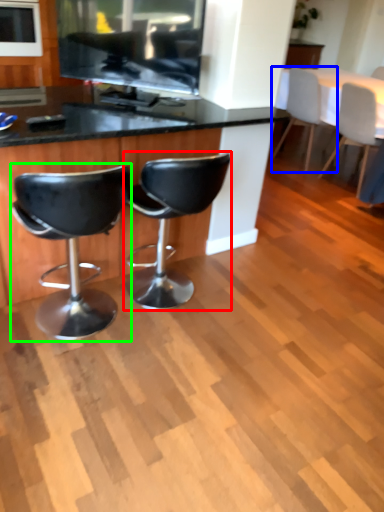
Question: Which object is the closest to the chair (highlighted by a red box)? Choose among these: chair (highlighted by a blue box) or chair (highlighted by a green box).

Choices:
 (A) chair
 (B) chair

Answer: (B)